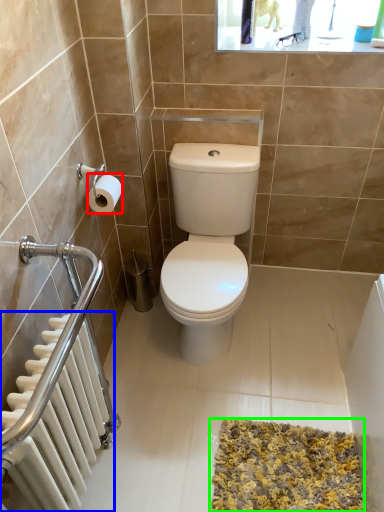
Question: Considering the real-world distances, which object is farthest from toilet paper (highlighted by a red box)? radiator (highlighted by a blue box) or bath mat (highlighted by a green box)?

Choices:
 (A) radiator
 (B) bath mat

Answer: (B)